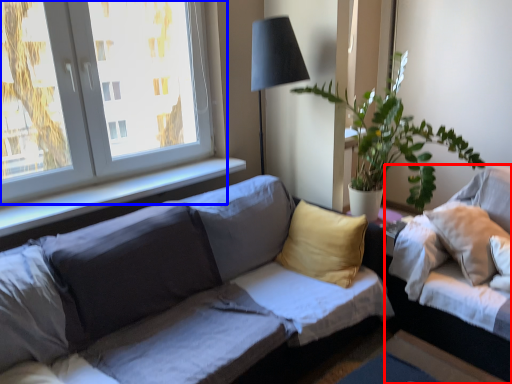
Question: Which object appears closest to the camera in this image, studio couch (highlighted by a red box) or window (highlighted by a blue box)?

Choices:
 (A) studio couch
 (B) window

Answer: (A)